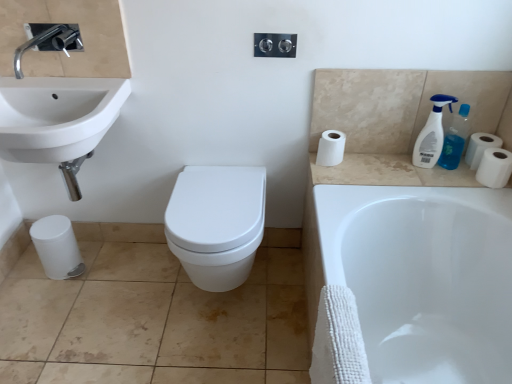
Find the location of a particular element. Image resolution: width=512 pixels, height=384 pixels. vacant region under white glossy toilet at center (from a real-world perspective) is located at coordinates (222, 304).